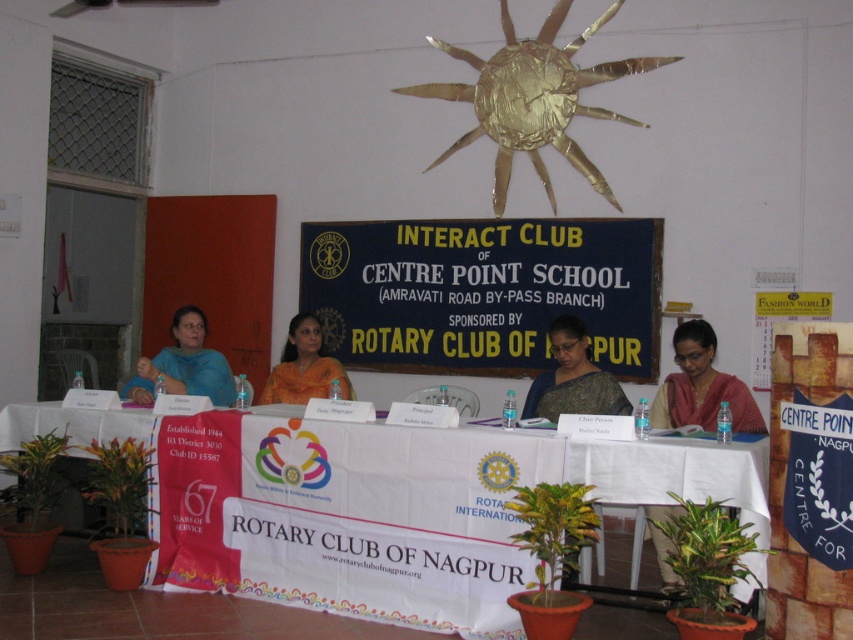
Question: Is matte blue sari at left bigger than satin yellow saree at center?

Choices:
 (A) yes
 (B) no

Answer: (A)

Question: Based on their relative distances, which object is farther from the satin yellow saree at center?

Choices:
 (A) matte black saree at center
 (B) matte blue sari at left
 (C) blue fabric sign at center

Answer: (C)

Question: Is white cloth table at center positioned before blue fabric sign at center?

Choices:
 (A) yes
 (B) no

Answer: (A)

Question: Which point is closer to the camera?

Choices:
 (A) (369, 502)
 (B) (183, 369)
 (C) (413, 236)
 (D) (688, 380)

Answer: (A)

Question: Is white cloth table at center behind blue fabric sign at center?

Choices:
 (A) yes
 (B) no

Answer: (B)

Question: Among these objects, which one is farthest from the camera?

Choices:
 (A) blue fabric sign at center
 (B) satin yellow saree at center
 (C) matte blue sari at left
 (D) white cloth table at center

Answer: (A)